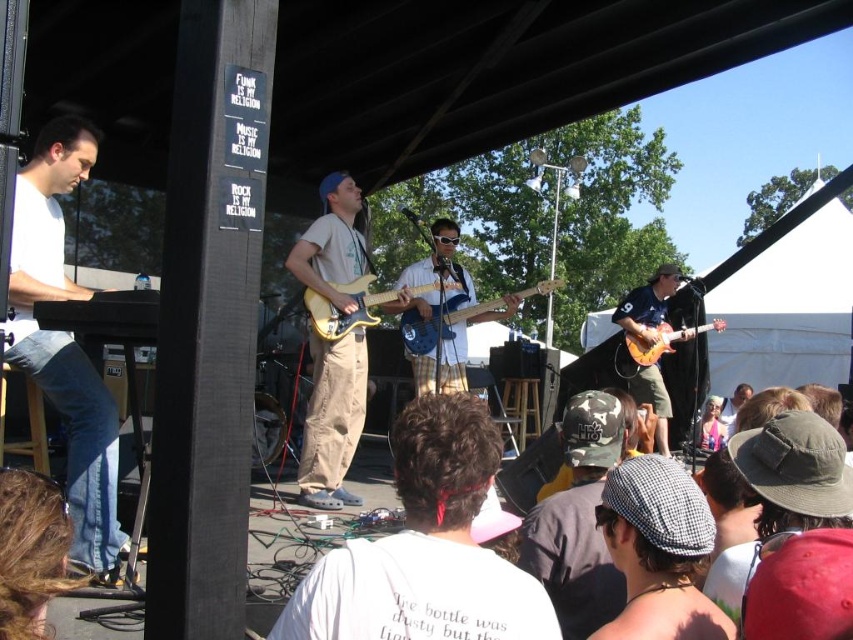
Question: Which of the following is the closest to the observer?

Choices:
 (A) (15, 292)
 (B) (537, 605)

Answer: (B)

Question: Which of the following is the closest to the observer?

Choices:
 (A) (113, 582)
 (B) (321, 308)
 (C) (672, 499)
 (D) (637, 298)

Answer: (C)

Question: Which of these objects is positioned closest to the shiny orange electric guitar at center?

Choices:
 (A) pink fabric at center
 (B) matte blue electric guitar at center

Answer: (B)

Question: Is white cotton t-shirt at center to the right of checkered fabric cap at lower center from the viewer's perspective?

Choices:
 (A) yes
 (B) no

Answer: (B)

Question: Can you confirm if white matte keyboard at left is positioned to the right of pink fabric at center?

Choices:
 (A) no
 (B) yes

Answer: (A)

Question: Is matte yellow guitar at center wider than shiny orange electric guitar at center?

Choices:
 (A) yes
 (B) no

Answer: (B)